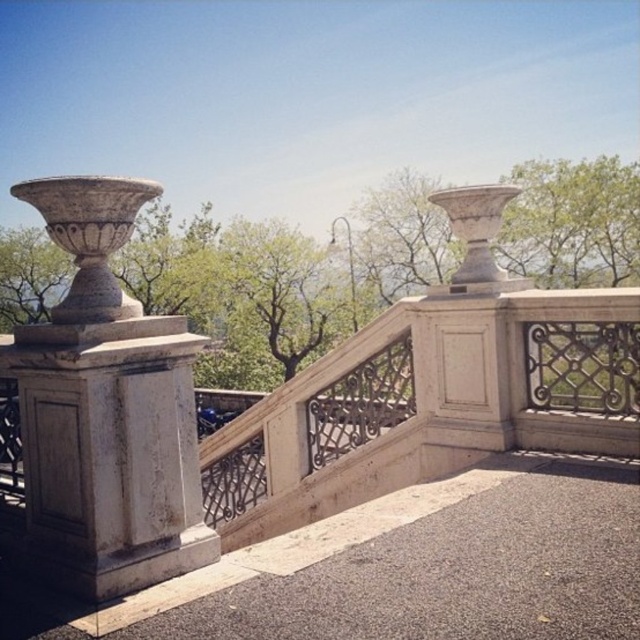
Image resolution: width=640 pixels, height=640 pixels. Find the location of `white marble vase at left`. white marble vase at left is located at coordinates (106, 410).

You are a GUI agent. You are given a task and a screenshot of the screen. Output one action in this format:
    pyautogui.click(x=<x>, y=<y>)
    Task: Click on the white marble vase at left
    This screenshot has width=640, height=640.
    Given the screenshot: What is the action you would take?
    pyautogui.click(x=106, y=410)